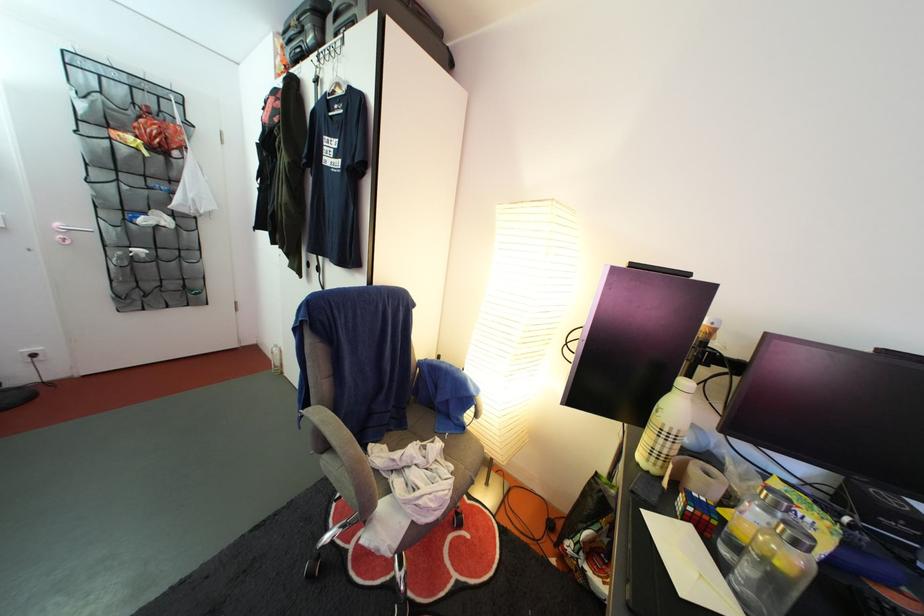
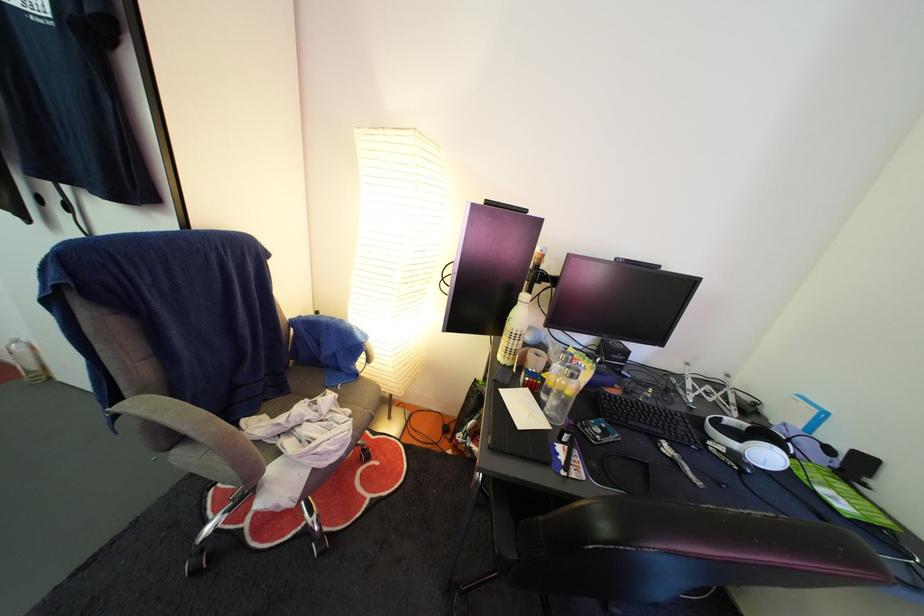
In the second image, find the point that corresponds to point 330,410 in the first image.

(152, 400)